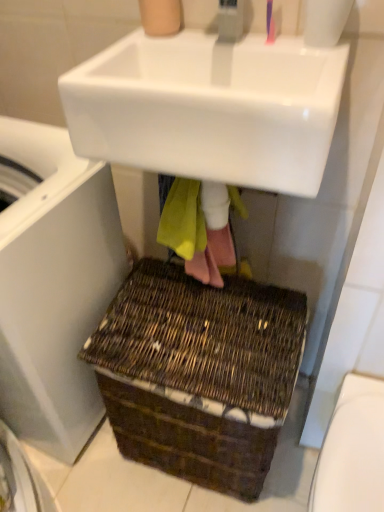
Image resolution: width=384 pixels, height=512 pixels. I want to click on vacant area that is in front of pink plastic toothbrush at upper center, so click(285, 56).